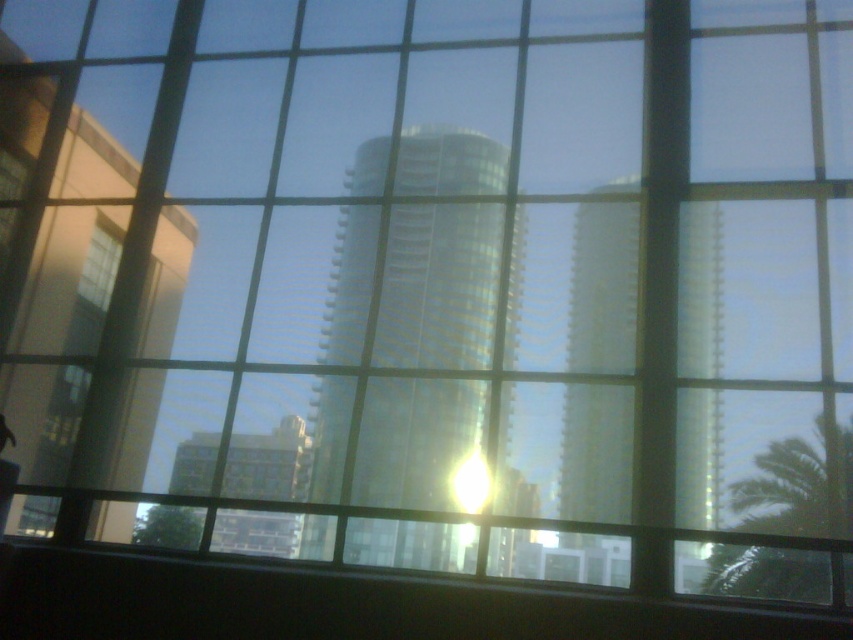
You are standing inside a room and looking through the window. You notice the shiny glass tower at center and the green leafy palm tree at lower right. Which object is positioned higher in the window frame?

The shiny glass tower at center is located above the green leafy palm tree at lower right, so it is positioned higher in the window frame.

You are standing in a room with a large window. You notice a point at coordinates [438,285] on the window. What object is located at that point?

The shiny glass tower at center is located at point [438,285].

You are standing in a room with a large window. There is a point marked at coordinates point (x=689, y=294). If you want to touch this point on the window with a 6.5 feet long stick, can you reach it?

The point (x=689, y=294) is 7.66 feet away from the camera, so the 6.5 feet long stick is not long enough to reach it.